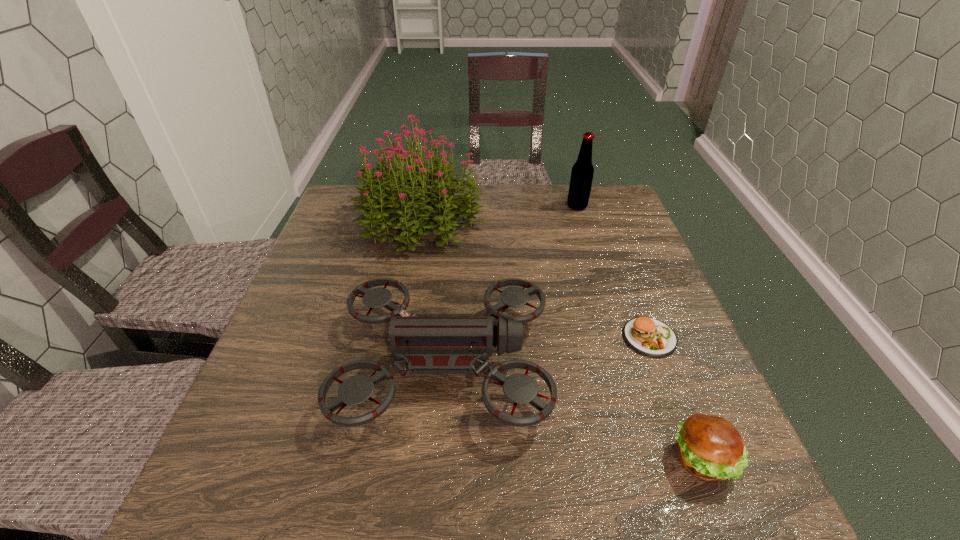
The image size is (960, 540). I want to click on vacant area between the shortest object and the second shortest object, so click(x=676, y=399).

This screenshot has height=540, width=960. Find the location of `free point between the bouquet and the hamburger`. free point between the bouquet and the hamburger is located at coordinates (563, 339).

In order to click on free space between the bouquet and the second tallest object in this screenshot , I will do `click(499, 212)`.

This screenshot has height=540, width=960. In order to click on object that is the third closest to the tallest object in this screenshot , I will do `click(651, 337)`.

Identify which object is the third closest to the third tallest object. Please provide its 2D coordinates. Your answer should be formatted as a tuple, i.e. [(x, y)], where the tuple contains the x and y coordinates of a point satisfying the conditions above.

[(710, 448)]

The height and width of the screenshot is (540, 960). I want to click on blank area in the image that satisfies the following two spatial constraints: 1. on the front-facing side of the drone; 2. on the left side of the hamburger, so tap(438, 460).

Where is `blank space that satisfies the following two spatial constraints: 1. on the front side of the shortest object; 2. on the right side of the tallest object`? blank space that satisfies the following two spatial constraints: 1. on the front side of the shortest object; 2. on the right side of the tallest object is located at coordinates (400, 338).

Find the location of a particular element. Image resolution: width=960 pixels, height=540 pixels. free space that satisfies the following two spatial constraints: 1. on the front-facing side of the fourth tallest object; 2. on the left side of the drone is located at coordinates (438, 460).

Locate an element on the screen. The image size is (960, 540). free region that satisfies the following two spatial constraints: 1. on the front side of the second tallest object; 2. on the front-facing side of the third shortest object is located at coordinates (626, 363).

Find the location of a particular element. This screenshot has height=540, width=960. vacant space that satisfies the following two spatial constraints: 1. on the front-facing side of the drone; 2. on the right side of the second shortest object is located at coordinates (438, 460).